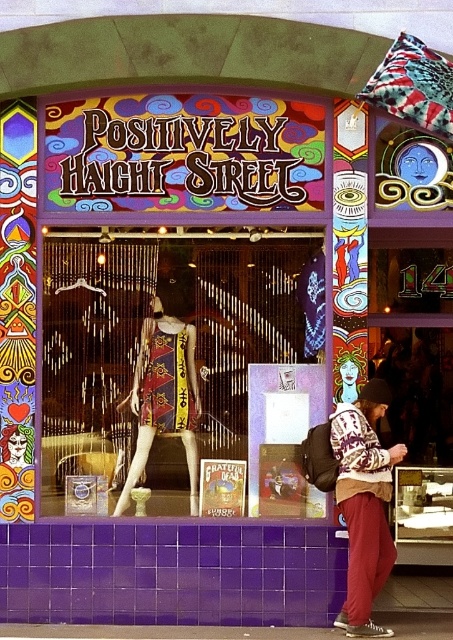
You are a customer looking at the window display of the store. You see a knit sweater at center and a printed fabric dress at center. Which item takes up more space in the display?

The knit sweater at center is bigger than the printed fabric dress at center, so it takes up more space in the display.

You are a customer in the store and want to check both the knit sweater at center and the printed fabric dress at center. Which one is closer to the left side of the window display?

The printed fabric dress at center is closer to the left side of the window display because the knit sweater at center is to the right of it.